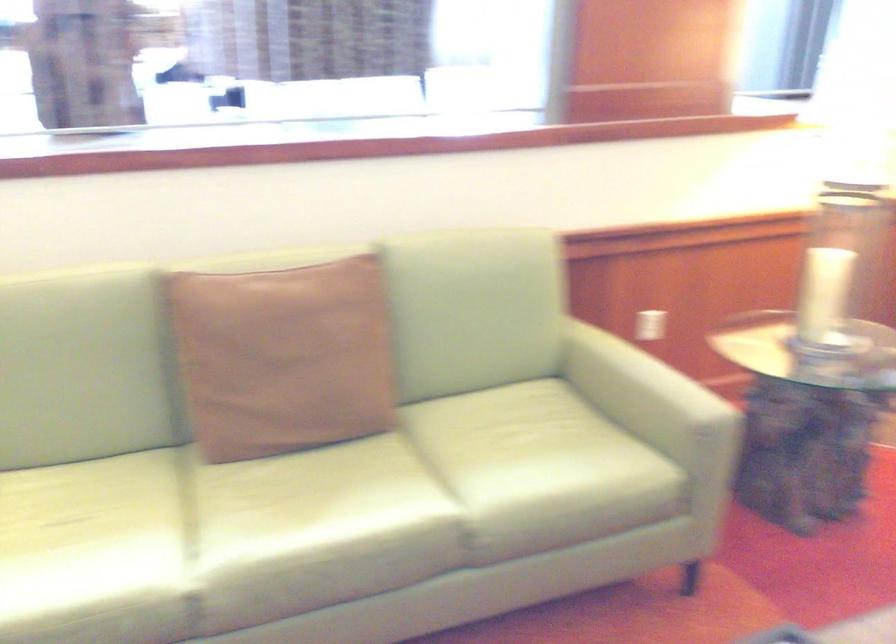
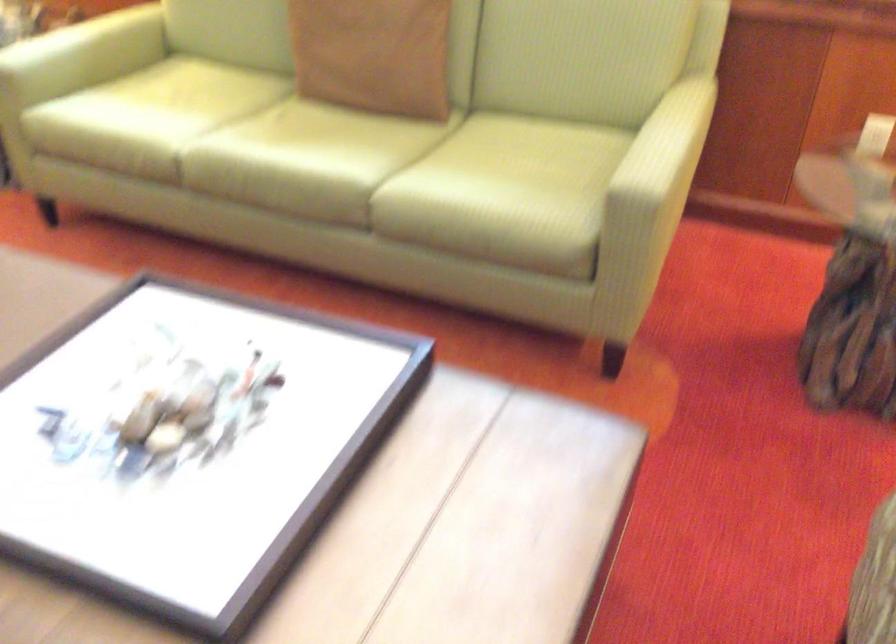
Locate, in the second image, the point that corresponds to [325,388] in the first image.

(373, 55)